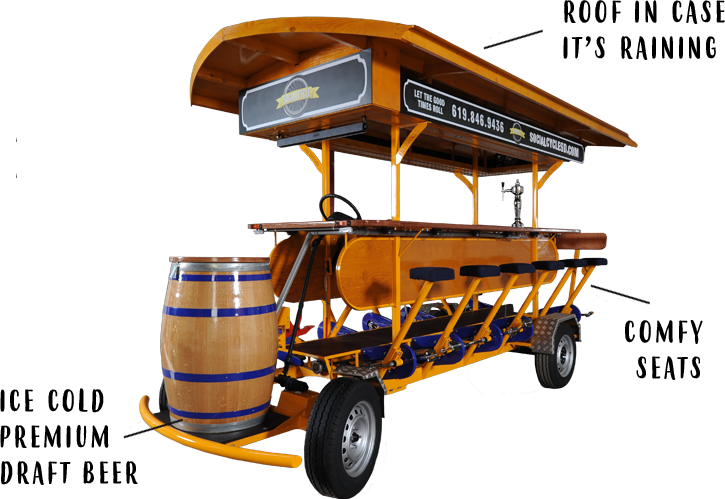
Find the location of a particular element. The height and width of the screenshot is (499, 725). left side seats is located at coordinates (438, 277), (478, 272), (515, 274), (550, 268), (573, 266), (592, 264).